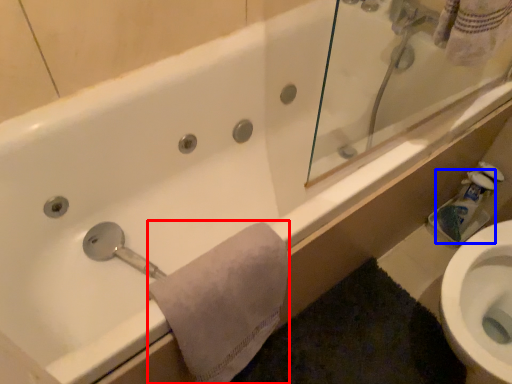
Question: Which of the following is the farthest to the observer, bath towel (highlighted by a red box) or toilet paper (highlighted by a blue box)?

Choices:
 (A) bath towel
 (B) toilet paper

Answer: (B)